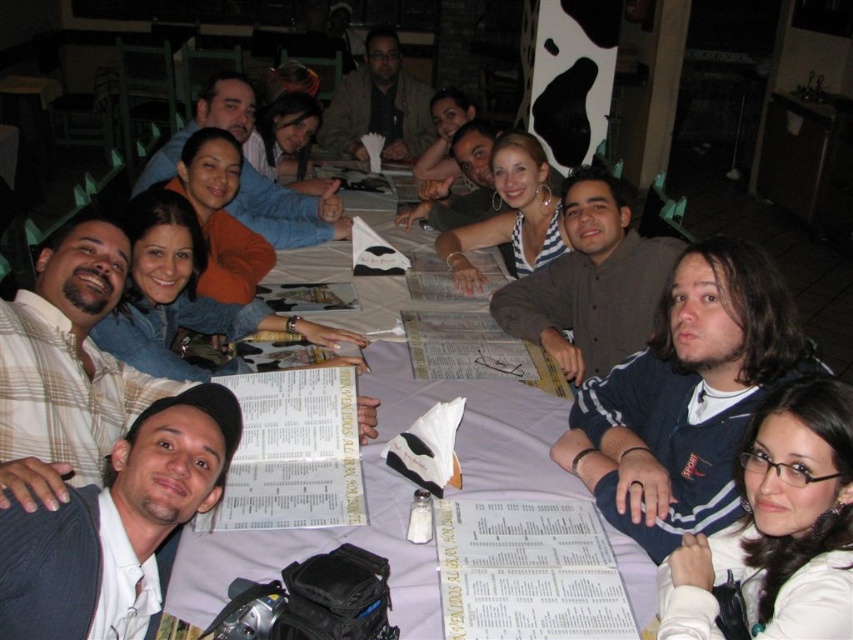
Question: Does white paper table at center have a larger size compared to dark gray knit cap at lower left?

Choices:
 (A) no
 (B) yes

Answer: (B)

Question: Among these objects, which one is farthest from the camera?

Choices:
 (A) white paper table at center
 (B) striped fabric top at center
 (C) dark gray knit cap at lower left
 (D) white matte jacket at lower right

Answer: (B)

Question: Among these points, which one is nearest to the camera?

Choices:
 (A) (338, 115)
 (B) (650, 289)
 (C) (206, 385)

Answer: (C)

Question: Can you confirm if dark gray knit cap at lower left is positioned to the left of striped fabric shirt at center?

Choices:
 (A) yes
 (B) no

Answer: (A)

Question: Which of the following is the closest to the observer?

Choices:
 (A) dark blue jersey at lower right
 (B) striped fabric shirt at center

Answer: (A)

Question: Is dark blue jersey at lower right wider than white paper table at center?

Choices:
 (A) no
 (B) yes

Answer: (A)